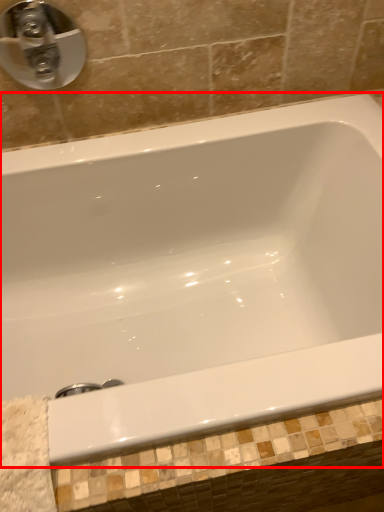
Question: From the image's perspective, where is bathtub (annotated by the red box) located in relation to tap in the image?

Choices:
 (A) below
 (B) above

Answer: (A)